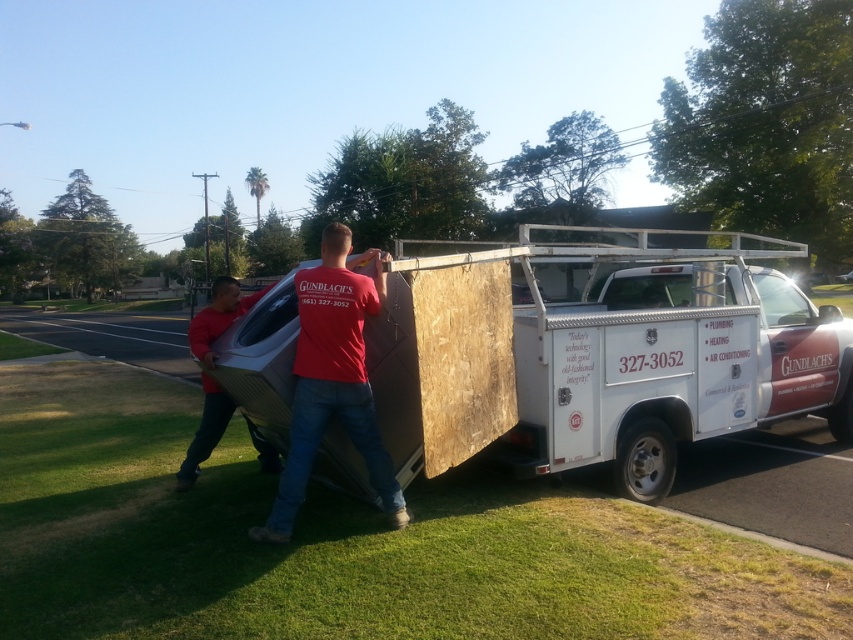
Question: Which object is positioned farthest from the matte red shirt at center?

Choices:
 (A) red matte shirt at center
 (B) white matte truck at center

Answer: (B)

Question: Can you confirm if white matte truck at center is positioned to the right of red matte shirt at center?

Choices:
 (A) yes
 (B) no

Answer: (A)

Question: Considering the real-world distances, which object is closest to the white matte truck at center?

Choices:
 (A) red matte shirt at center
 (B) matte red shirt at center

Answer: (B)

Question: Does white matte truck at center appear over matte red shirt at center?

Choices:
 (A) yes
 (B) no

Answer: (A)

Question: Can you confirm if white matte truck at center is positioned above matte red shirt at center?

Choices:
 (A) no
 (B) yes

Answer: (B)

Question: Among these objects, which one is nearest to the camera?

Choices:
 (A) matte red shirt at center
 (B) red matte shirt at center

Answer: (B)